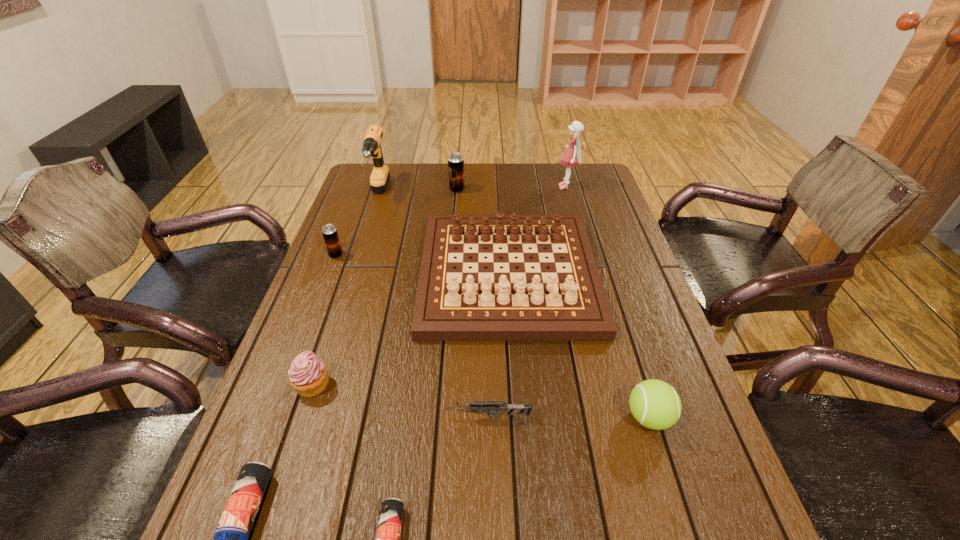
I want to click on tennis ball that is at the right edge, so click(655, 404).

Find the location of a particular element. object present at the far left corner is located at coordinates (380, 175).

Find the location of a particular element. This screenshot has width=960, height=540. object that is at the far right corner is located at coordinates (572, 155).

This screenshot has height=540, width=960. In the image, there is a desktop. What are the coordinates of `vacant space at the far edge` in the screenshot? It's located at (536, 175).

The image size is (960, 540). In the image, there is a desktop. Find the location of `vacant space at the left edge`. vacant space at the left edge is located at coordinates (343, 282).

Locate an element on the screen. free point at the right edge is located at coordinates point(614,288).

At what (x,y) coordinates should I click in order to perform the action: click on vacant space that's between the doll and the drill. Please return your answer as a coordinate pair (x, y). Looking at the image, I should click on coord(472,191).

Image resolution: width=960 pixels, height=540 pixels. In order to click on vacant region between the drill and the pink doll in this screenshot , I will do click(x=472, y=191).

Locate which object is the eighth closest to the right blue beer can. Please provide its 2D coordinates. Your answer should be formatted as a tuple, i.e. [(x, y)], where the tuple contains the x and y coordinates of a point satisfying the conditions above.

[(455, 160)]

Identify the location of the sixth closest object to the cupcake. (x=380, y=175).